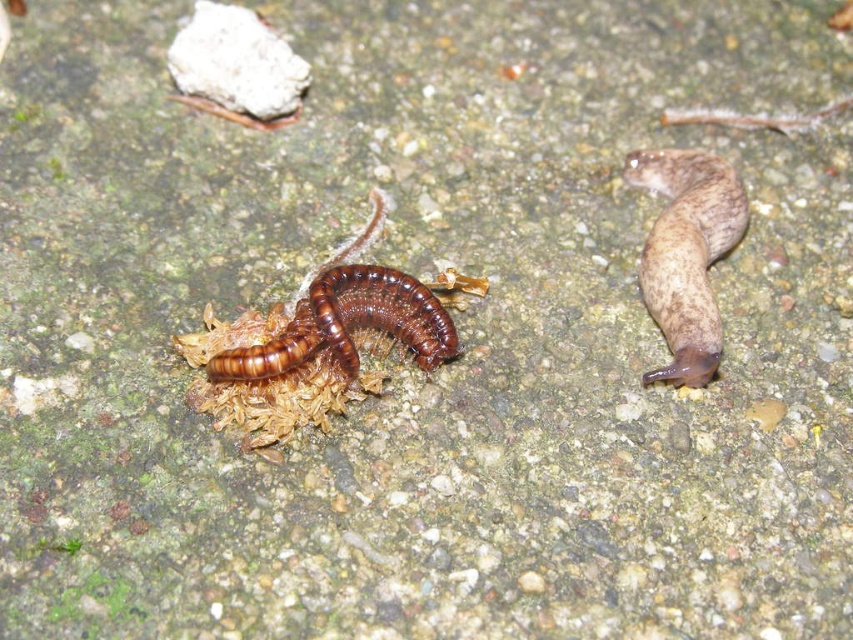
Question: Which point appears farthest from the camera in this image?

Choices:
 (A) (700, 195)
 (B) (341, 282)

Answer: (A)

Question: Does brown rubbery snail at right appear under brown shiny centipede at center?

Choices:
 (A) no
 (B) yes

Answer: (A)

Question: Which object appears closest to the camera in this image?

Choices:
 (A) brown rubbery snail at right
 (B) brown shiny centipede at center

Answer: (B)

Question: Is brown rubbery snail at right further to camera compared to brown shiny centipede at center?

Choices:
 (A) no
 (B) yes

Answer: (B)

Question: Where is brown rubbery snail at right located in relation to brown shiny centipede at center in the image?

Choices:
 (A) left
 (B) right

Answer: (B)